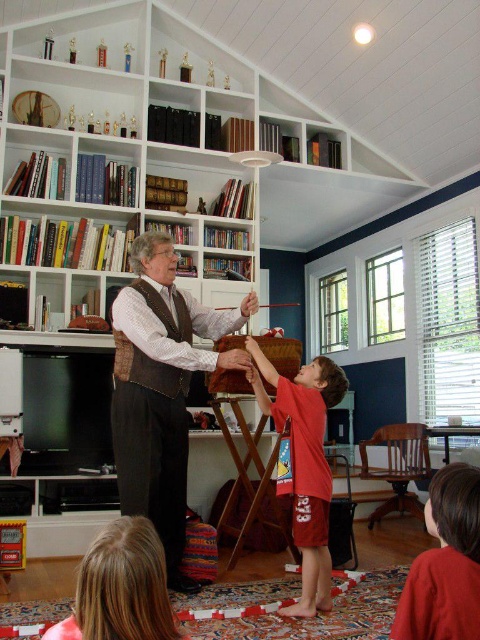
You are a parent trying to reach a book from the white wood bookcase at upper center while holding your child. If you are standing 4.12 meters away from the bookcase, can you comfortably reach it without moving closer?

The distance between you and the white wood bookcase at upper center is 4.12 meters. Since this distance is quite far, you would likely need to move closer to comfortably reach the book without straining.

You are a parent trying to dress your child for a cold day. You have two options on the floor in front of you, a brown leather vest at center and red cotton shorts at lower center. Which item is taller and thus more suitable for covering the upper body?

The brown leather vest at center is taller than the red cotton shorts at lower center, making it more suitable for covering the upper body.

You are standing in the living room and want to place a new decorative item exactly where the red cotton shorts at lower center are located. According to the coordinates provided, what are the exact coordinates where you should place the decorative item?

The exact coordinates for placing the decorative item should be at point (x=304, y=464), as that is the 2D location of the red cotton shorts at lower center.